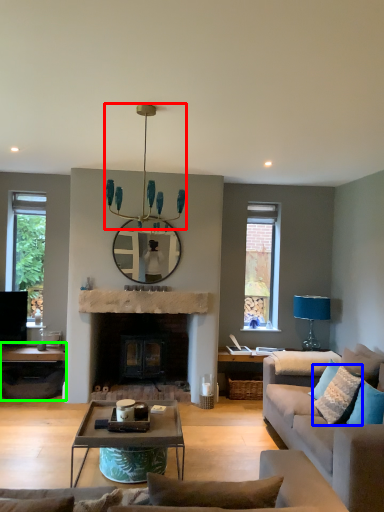
Question: Which object is positioned farthest from light fixture (highlighted by a red box)? Select from pillow (highlighted by a blue box) and table (highlighted by a green box).

Choices:
 (A) pillow
 (B) table

Answer: (A)